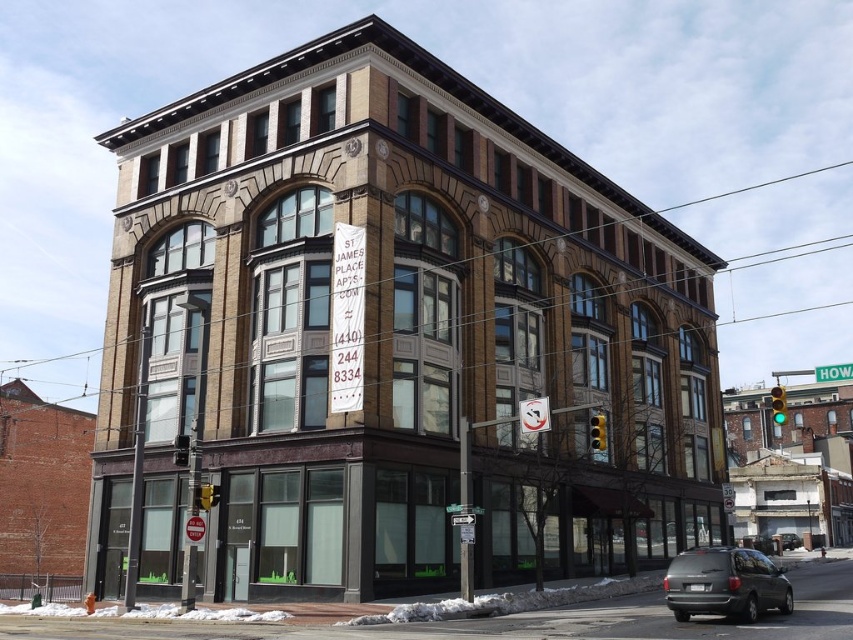
You are a delivery person trying to park your vehicle in the parking lot behind the building. The parking spot you want is between the matte gray minivan at lower right and the black matte van at center. Since the parking spot is narrow, you need to know which vehicle is taller to avoid hitting it. Which vehicle is taller?

The matte gray minivan at lower right is much taller than the black matte van at center, so you should be cautious of the matte gray minivan at lower right when parking to avoid hitting it.

You are standing in front of the building and want to take a photo. You notice two points marked on the building facade. The first point is at coordinate point (701, 556) and the second is at point (781, 545). Which point will appear larger in your camera view?

Point (701, 556) is closer to the camera than point (781, 545). Since it is closer, it will appear larger in the camera view.

You are a delivery driver who needs to park your vehicle in the parking lot adjacent to St James Place Apts. The parking lot has a width of 20 feet. You have two vehicles to park, a matte gray minivan at lower right and a black matte van at center. Which vehicle can you park in the parking lot without exceeding the width limit?

The matte gray minivan at lower right is 192.27 feet from the black matte van at center, but the distance between them does not indicate their individual widths. Since the parking lot is 20 feet wide, both vehicles can fit as their widths are likely within the limit unless specified otherwise.